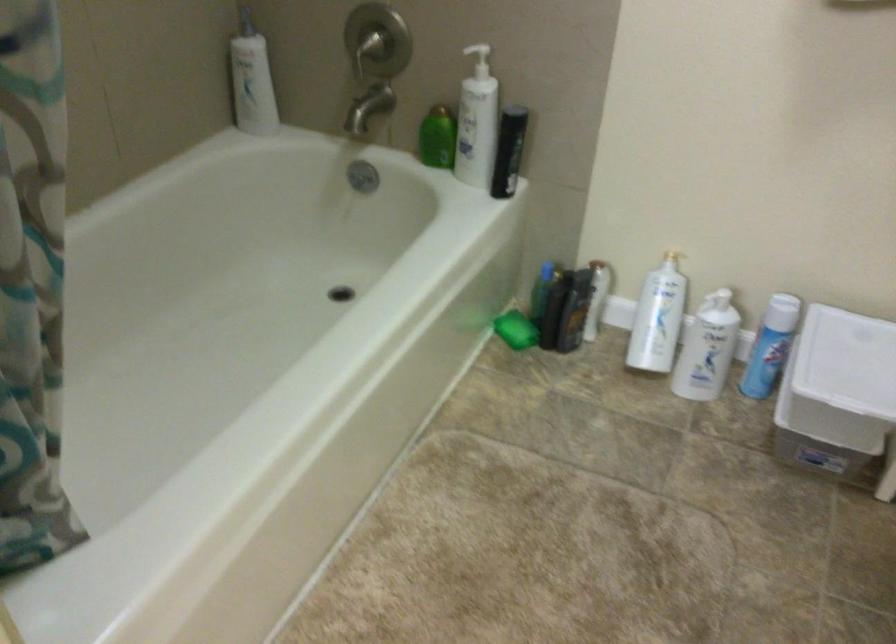
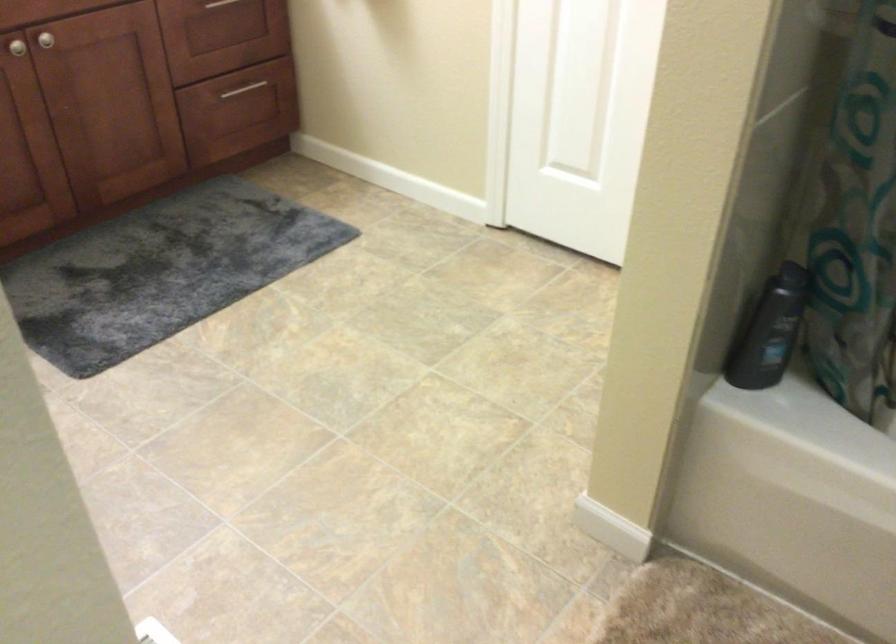
Based on the continuous images, in which direction is the camera rotating?

The camera's rotation is toward left-down.